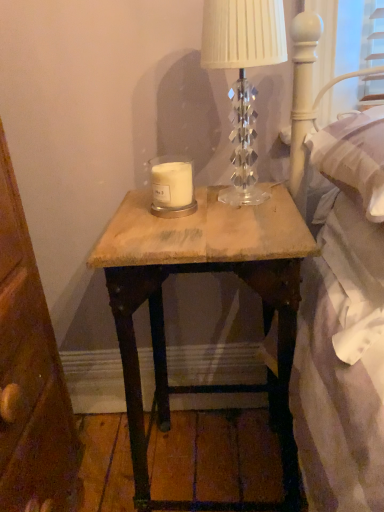
Find the location of a particular element. The height and width of the screenshot is (512, 384). free space on the front side of white matte candle at center is located at coordinates (186, 227).